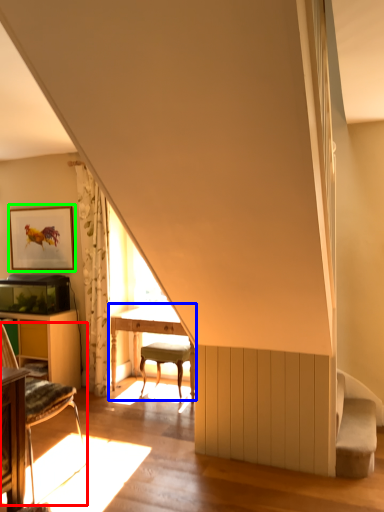
Question: Which is nearer to the chair (highlighted by a red box)? table (highlighted by a blue box) or picture frame (highlighted by a green box).

Choices:
 (A) table
 (B) picture frame

Answer: (A)